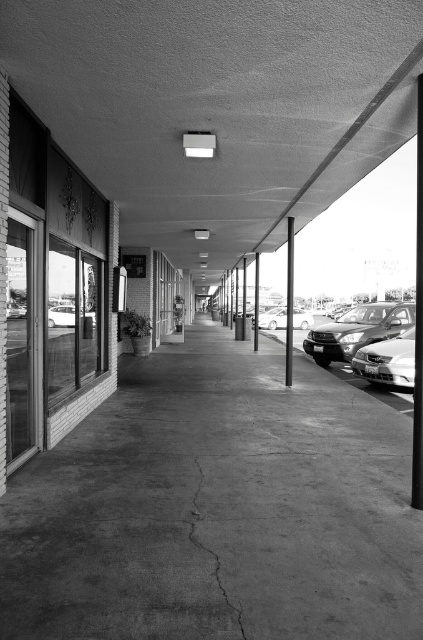
You are a delivery person with a cart that is 20 feet long. You need to navigate through the walkway shown in the image. Can your cart fit between the cracked concrete at center and the smooth concrete pillar at center?

The cracked concrete at center and smooth concrete pillar at center are 21.35 feet apart from each other. Since your cart is 20 feet long, it can fit between them with 1.35 feet of space remaining.

You are driving a car and want to park it on the right side of the walkway. There is a shiny silver sedan at right and a smooth concrete pillar at center. Which object is closer to the parking spot on the right side?

The shiny silver sedan at right is closer to the parking spot on the right side because it is positioned to the right of the smooth concrete pillar at center.

Consider the image. You are standing at the point labeled point at (x=384, y=358) and want to walk to the end of the walkway. The walkway is 10.02 meters long. If your walking speed is 1.2 meters per second, how many seconds will it take you to reach the end?

The walkway is 10.02 meters long. At a speed of 1.2 meters per second, it will take approximately 8.35 seconds to reach the end.